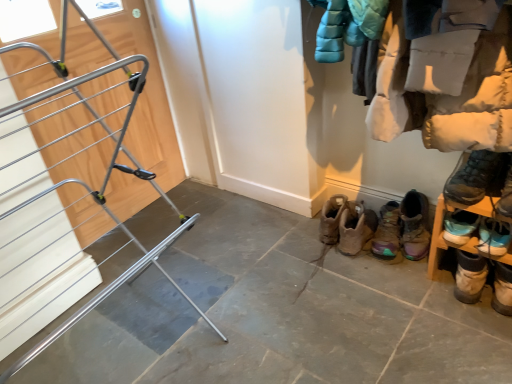
Identify the location of vacant space to the left of brown suede boot at lower right, which is counted as the sixth footwear, starting from the right. This screenshot has height=384, width=512. (311, 254).